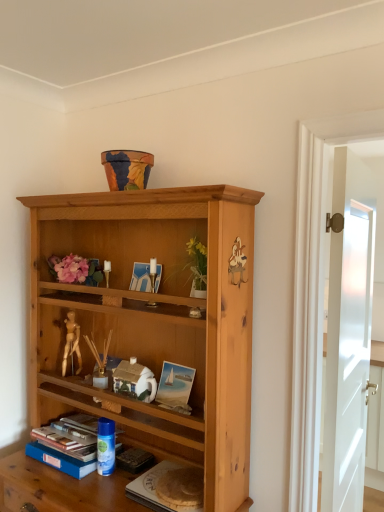
Question: Does blue plastic can at lower center have a greater height compared to blue hardcover book at lower left?

Choices:
 (A) no
 (B) yes

Answer: (B)

Question: Considering the relative sizes of blue plastic can at lower center and blue hardcover book at lower left in the image provided, is blue plastic can at lower center wider than blue hardcover book at lower left?

Choices:
 (A) yes
 (B) no

Answer: (B)

Question: Is blue plastic can at lower center positioned in front of blue hardcover book at lower left?

Choices:
 (A) yes
 (B) no

Answer: (B)

Question: Considering the relative positions of blue plastic can at lower center and blue hardcover book at lower left in the image provided, is blue plastic can at lower center behind blue hardcover book at lower left?

Choices:
 (A) yes
 (B) no

Answer: (A)

Question: Does blue plastic can at lower center appear on the right side of blue hardcover book at lower left?

Choices:
 (A) yes
 (B) no

Answer: (A)

Question: Are blue plastic can at lower center and blue hardcover book at lower left far apart?

Choices:
 (A) yes
 (B) no

Answer: (B)

Question: Does blue hardcover book at lower left appear on the left side of hardcover book at lower center?

Choices:
 (A) no
 (B) yes

Answer: (B)

Question: Is blue hardcover book at lower left positioned beyond the bounds of hardcover book at lower center?

Choices:
 (A) no
 (B) yes

Answer: (B)

Question: Can you confirm if blue hardcover book at lower left is thinner than hardcover book at lower center?

Choices:
 (A) yes
 (B) no

Answer: (B)

Question: Can you confirm if blue hardcover book at lower left is positioned to the right of hardcover book at lower center?

Choices:
 (A) yes
 (B) no

Answer: (B)

Question: Is blue hardcover book at lower left with hardcover book at lower center?

Choices:
 (A) no
 (B) yes

Answer: (A)

Question: From a real-world perspective, does blue hardcover book at lower left stand above hardcover book at lower center?

Choices:
 (A) no
 (B) yes

Answer: (B)

Question: Considering the relative sizes of blue hardcover book at lower left and blue plastic can at lower center in the image provided, is blue hardcover book at lower left taller than blue plastic can at lower center?

Choices:
 (A) no
 (B) yes

Answer: (A)